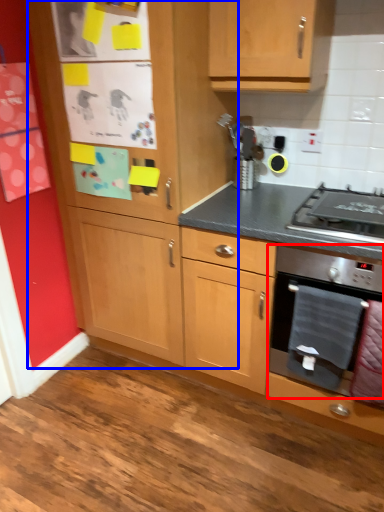
Question: Which point is further to the camera, kitchen appliance (highlighted by a red box) or cabinetry (highlighted by a blue box)?

Choices:
 (A) kitchen appliance
 (B) cabinetry

Answer: (A)